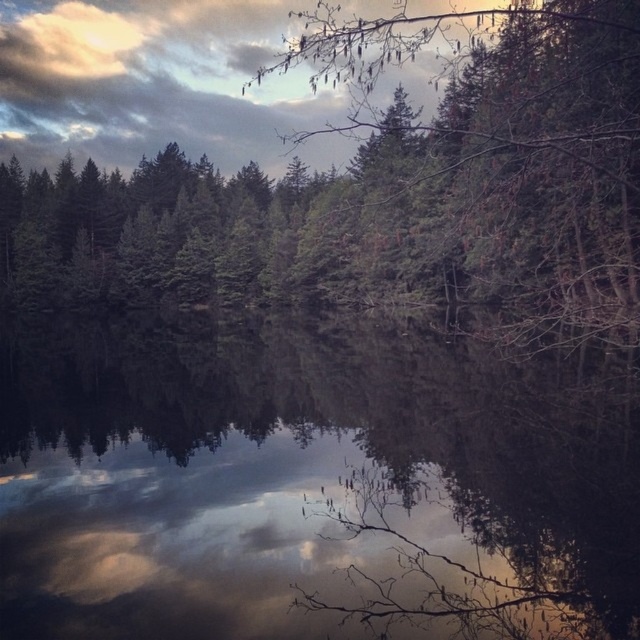
Question: Among these objects, which one is nearest to the camera?

Choices:
 (A) green matte tree at upper center
 (B) glossy reflective water at center

Answer: (B)

Question: Which object is closer to the camera taking this photo?

Choices:
 (A) green matte tree at upper center
 (B) glossy reflective water at center

Answer: (B)

Question: In this image, where is glossy reflective water at center located relative to green matte tree at upper center?

Choices:
 (A) left
 (B) right

Answer: (B)

Question: Can you confirm if glossy reflective water at center is positioned above green matte tree at upper center?

Choices:
 (A) yes
 (B) no

Answer: (B)

Question: Does glossy reflective water at center have a smaller size compared to green matte tree at upper center?

Choices:
 (A) no
 (B) yes

Answer: (B)